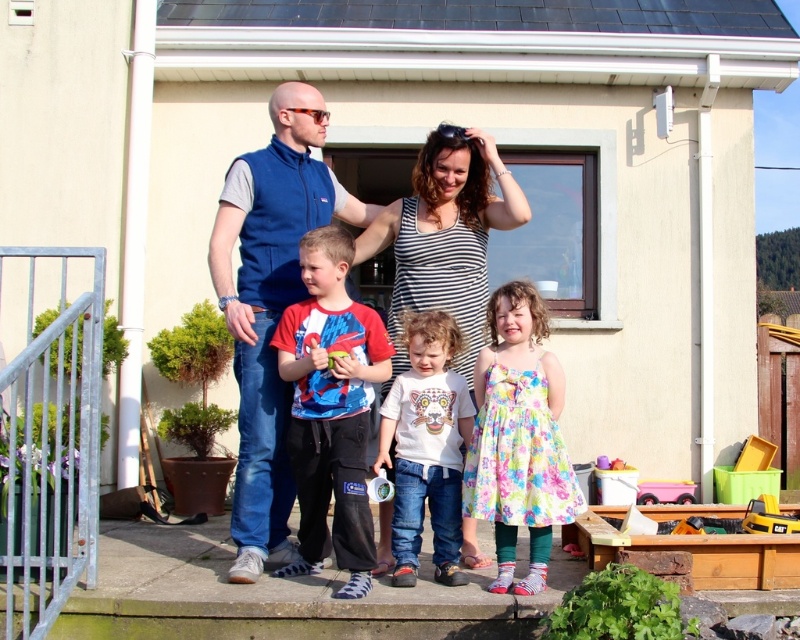
You are standing in front of the house and see the point at coordinates (448, 230). What object is located at that point?

The point at coordinates (448, 230) indicates the matte blue vest at upper left.